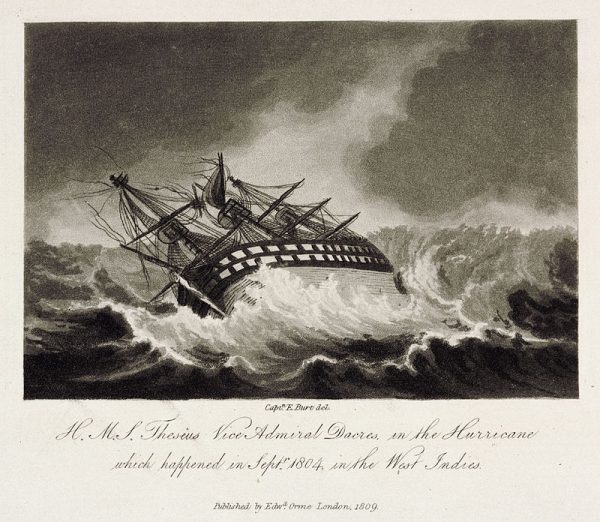
Locate an element on the screen. Image resolution: width=600 pixels, height=522 pixels. the lower right corner of artwork is located at coordinates (574, 397).